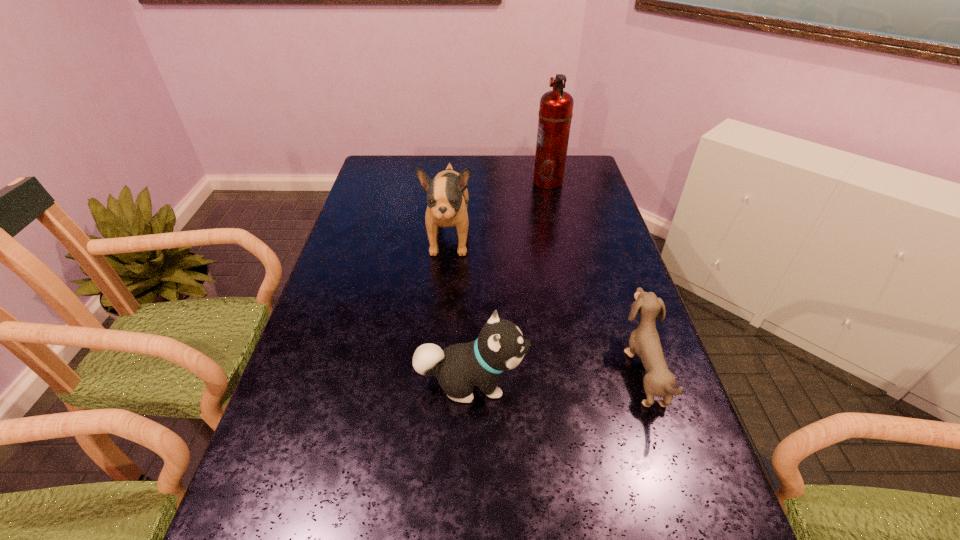
I want to click on free location located at the face of the third shortest object, so click(x=441, y=338).

Where is `vacant space located at the face of the second shortest puppy`? The height and width of the screenshot is (540, 960). vacant space located at the face of the second shortest puppy is located at coordinates (566, 382).

Where is `vacant space situated 0.150m at the face of the rightmost object`? The width and height of the screenshot is (960, 540). vacant space situated 0.150m at the face of the rightmost object is located at coordinates (563, 371).

Locate an element on the screen. The height and width of the screenshot is (540, 960). vacant space located at the face of the rightmost object is located at coordinates (480, 371).

Identify the location of free region located 0.080m at the face of the rightmost object. (592, 371).

The height and width of the screenshot is (540, 960). Identify the location of object at the far edge. pos(555,114).

Identify the location of fire extinguisher located at the right edge. The width and height of the screenshot is (960, 540). (555, 114).

The width and height of the screenshot is (960, 540). Find the location of `puppy that is positioned at the right edge`. puppy that is positioned at the right edge is located at coordinates (644, 341).

At what (x,y) coordinates should I click in order to perform the action: click on object at the far right corner. Please return your answer as a coordinate pair (x, y). Image resolution: width=960 pixels, height=540 pixels. Looking at the image, I should click on (555, 114).

In the image, there is a desktop. Where is `vacant space at the far edge`? The height and width of the screenshot is (540, 960). vacant space at the far edge is located at coordinates (426, 158).